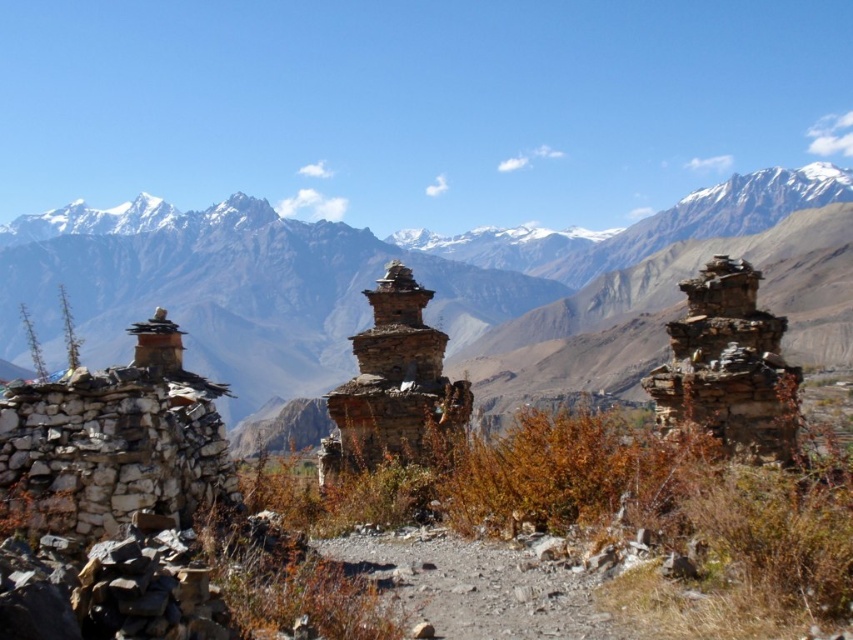
You are standing at the point with coordinates point [730,355] and want to walk towards point [456,419]. According to the image, will you be moving towards the foreground or the background?

Since point [730,355] is in front of point [456,419], moving from point [730,355] towards point [456,419] means you are moving towards the background.

You are hiking on a mountain trail and see the rustic stone stupa at right and the brown stone stupa at center. Which one is positioned higher up the mountain?

The rustic stone stupa at right is positioned higher up the mountain than the brown stone stupa at center because it is above it.